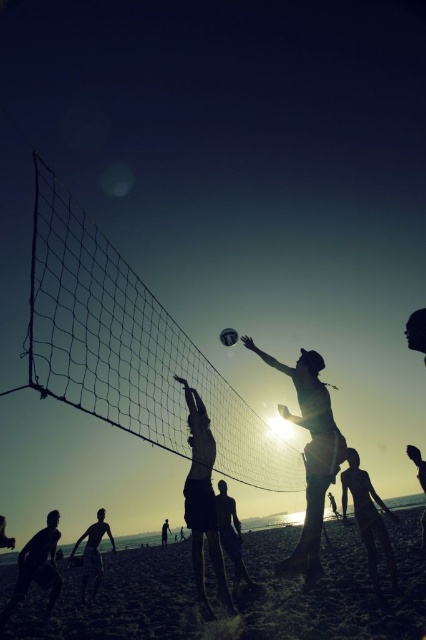
Question: Which object is closer to the camera taking this photo?

Choices:
 (A) silhouette sand at lower right
 (B) smooth sand beach at lower center
 (C) silhouette sand volleyball player at center

Answer: (C)

Question: Does smooth sand beach at lower center appear on the right side of silhouette of person at center?

Choices:
 (A) yes
 (B) no

Answer: (B)

Question: Based on their relative distances, which object is nearer to the black mesh net at center?

Choices:
 (A) silhouette sand volleyball player at center
 (B) silhouette sand at center

Answer: (B)

Question: Is dark skin human at center positioned behind white matte volleyball at center?

Choices:
 (A) yes
 (B) no

Answer: (A)

Question: In this image, where is black mesh net at center located relative to silhouette sand at lower right?

Choices:
 (A) right
 (B) left

Answer: (B)

Question: Which object appears farthest from the camera in this image?

Choices:
 (A) silhouette of person at center
 (B) dark skin human at center

Answer: (B)